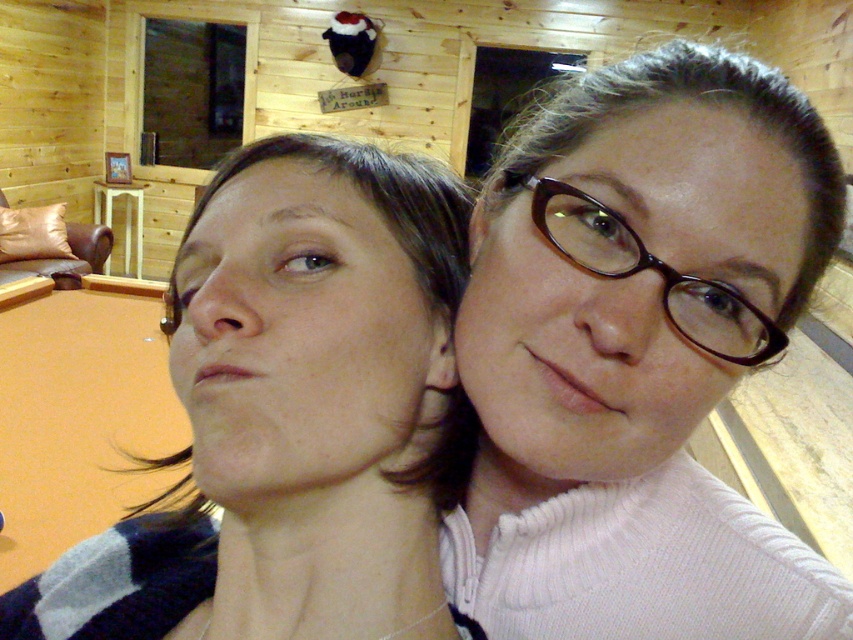
Can you confirm if white knit sweater at center is positioned above brown glossy glasses at center?

No, white knit sweater at center is not above brown glossy glasses at center.

Looking at this image, does white knit sweater at center have a greater width compared to brown glossy glasses at center?

Yes.

Image resolution: width=853 pixels, height=640 pixels. What do you see at coordinates (637, 355) in the screenshot?
I see `white knit sweater at center` at bounding box center [637, 355].

Locate an element on the screen. The image size is (853, 640). white knit sweater at center is located at coordinates (637, 355).

Is orange felt billiard table at lower left closer to camera compared to brown glossy glasses at center?

No, orange felt billiard table at lower left is further to the viewer.

Who is higher up, orange felt billiard table at lower left or brown glossy glasses at center?

brown glossy glasses at center is higher up.

Between point (80, 352) and point (689, 285), which one is positioned in front?

Point (689, 285) is in front.

Locate an element on the screen. orange felt billiard table at lower left is located at coordinates (78, 419).

Is matte blue sweater at left to the right of orange felt billiard table at lower left from the viewer's perspective?

Yes, matte blue sweater at left is to the right of orange felt billiard table at lower left.

Which of these two, matte blue sweater at left or orange felt billiard table at lower left, stands taller?

With more height is orange felt billiard table at lower left.

What do you see at coordinates (294, 413) in the screenshot? I see `matte blue sweater at left` at bounding box center [294, 413].

Image resolution: width=853 pixels, height=640 pixels. I want to click on matte blue sweater at left, so click(x=294, y=413).